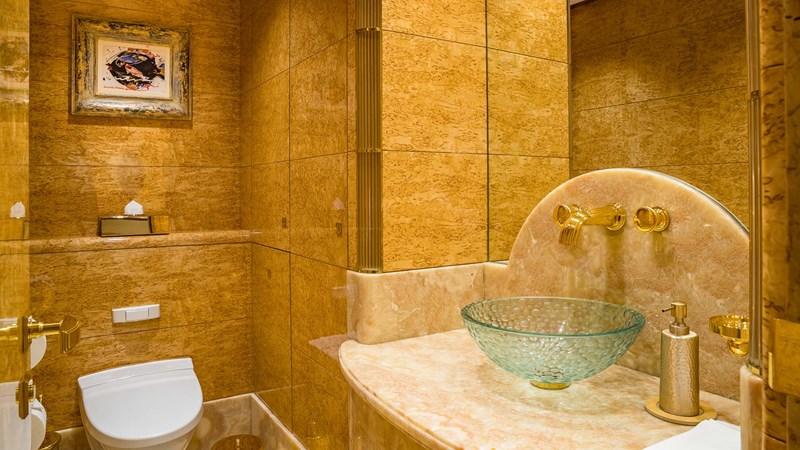
At what (x,y) coordinates should I click in order to perform the action: click on commode. Please return your answer as a coordinate pair (x, y). This screenshot has width=800, height=450. Looking at the image, I should click on (146, 412).